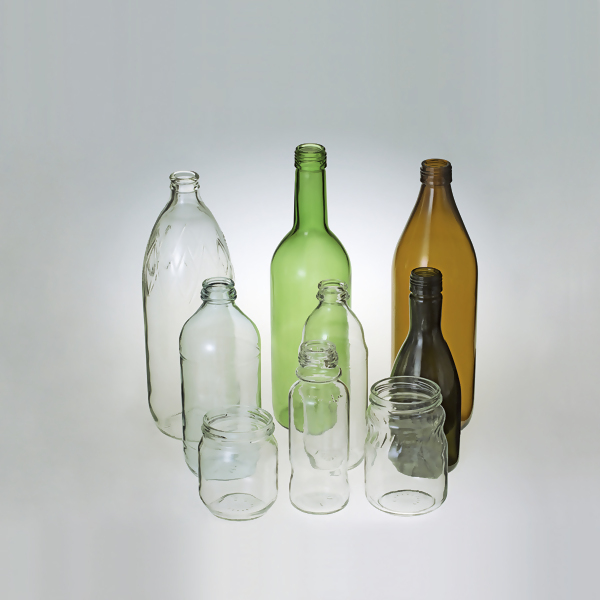
The height and width of the screenshot is (600, 600). In order to click on glass containers in this screenshot , I will do `click(182, 252)`, `click(305, 221)`, `click(447, 235)`, `click(425, 320)`, `click(338, 329)`, `click(227, 336)`, `click(241, 461)`, `click(329, 454)`, `click(417, 459)`.